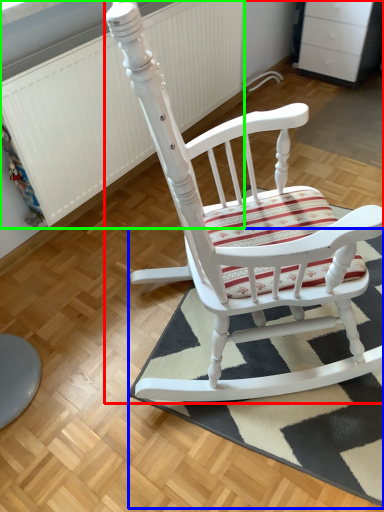
Question: Estimate the real-world distances between objects in this image. Which object is farther from chair (highlighted by a red box), doormat (highlighted by a blue box) or radiator (highlighted by a green box)?

Choices:
 (A) doormat
 (B) radiator

Answer: (B)